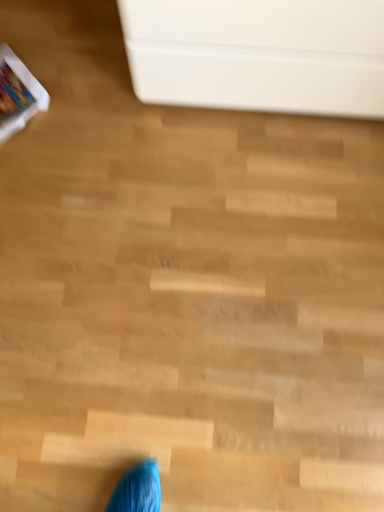
Where is `vacant space situated on the left part of white glossy dishwasher at upper center`? This screenshot has width=384, height=512. vacant space situated on the left part of white glossy dishwasher at upper center is located at coordinates (72, 100).